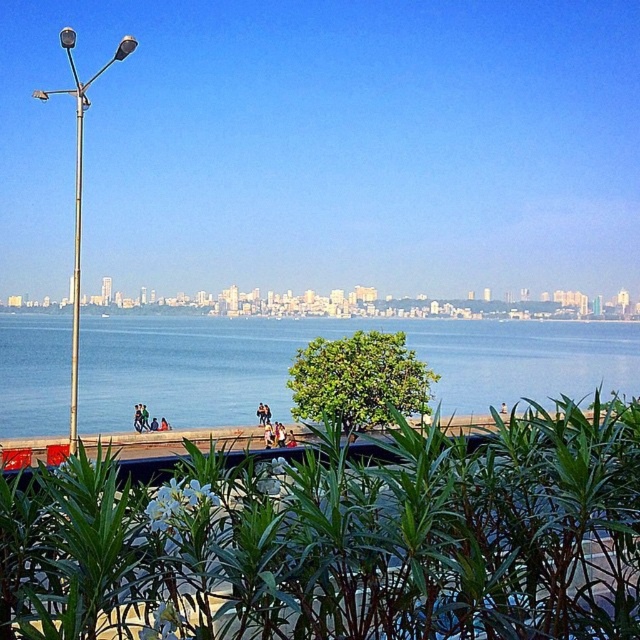
Question: Does green leafy bush at center appear on the left side of metallic pole at left?

Choices:
 (A) yes
 (B) no

Answer: (B)

Question: Does blue water at center lie in front of metallic pole at left?

Choices:
 (A) yes
 (B) no

Answer: (B)

Question: Considering the real-world distances, which object is closest to the metallic pole at left?

Choices:
 (A) green leafy plant at center
 (B) blue water at center
 (C) green leafy bush at center

Answer: (C)

Question: Which object is positioned closest to the green leafy plant at center?

Choices:
 (A) blue water at center
 (B) silver metallic pole at left

Answer: (B)

Question: Which point appears closest to the camera in this image?

Choices:
 (A) (115, 60)
 (B) (545, 394)
 (C) (259, 579)

Answer: (C)

Question: Does green leafy plant at center come behind green leafy bush at center?

Choices:
 (A) yes
 (B) no

Answer: (B)